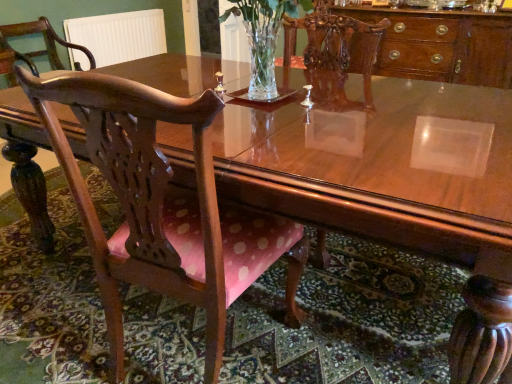
What are the coordinates of `empty space that is ontop of white ribbed radiator at upper left (from a real-world perspective)` in the screenshot? It's located at (109, 13).